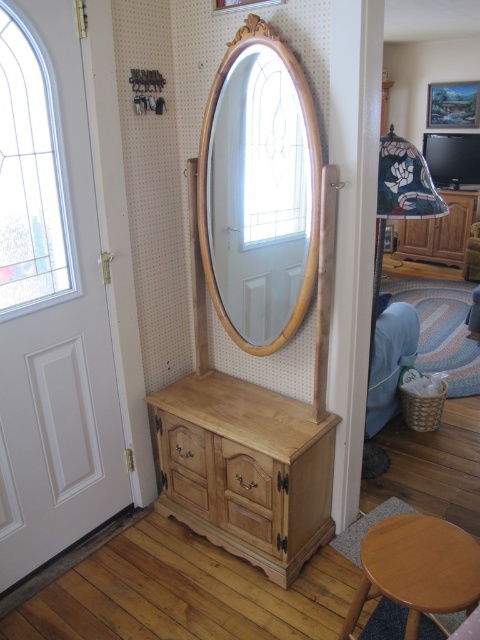
Question: Which of the following is the farthest from the observer?

Choices:
 (A) wooden mirror at center
 (B) wooden cabinet at right

Answer: (B)

Question: Does natural wood dresser at center appear over wooden cabinet at right?

Choices:
 (A) no
 (B) yes

Answer: (A)

Question: Does wooden mirror at center appear under natural wood dresser at center?

Choices:
 (A) no
 (B) yes

Answer: (A)

Question: Which point is farther to the camera?

Choices:
 (A) wooden mirror at center
 (B) light brown wooden stool at lower right
 (C) wooden drawer at center

Answer: (C)

Question: Does natural wood dresser at center have a greater width compared to light brown wooden stool at lower right?

Choices:
 (A) yes
 (B) no

Answer: (A)

Question: Which point is farther to the camera?

Choices:
 (A) (225, 481)
 (B) (420, 602)

Answer: (A)